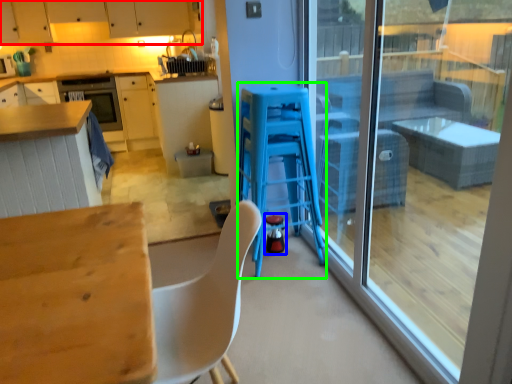
Question: Which object is the farthest from cabinetry (highlighted by a red box)? Choose among these: appliance (highlighted by a blue box) or bar stool (highlighted by a green box).

Choices:
 (A) appliance
 (B) bar stool

Answer: (A)